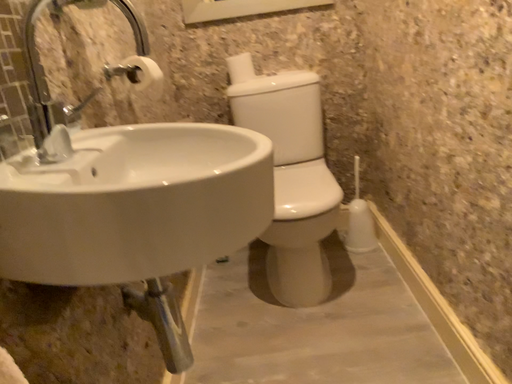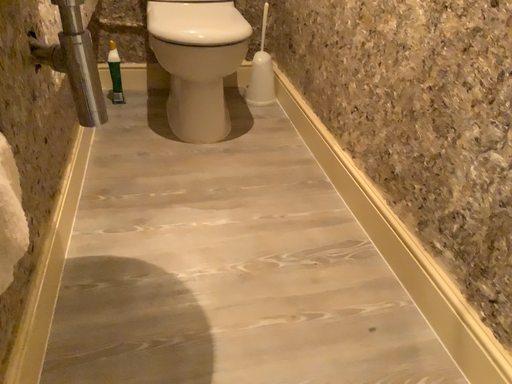
Question: How did the camera likely rotate when shooting the video?

Choices:
 (A) rotated right
 (B) rotated left

Answer: (A)